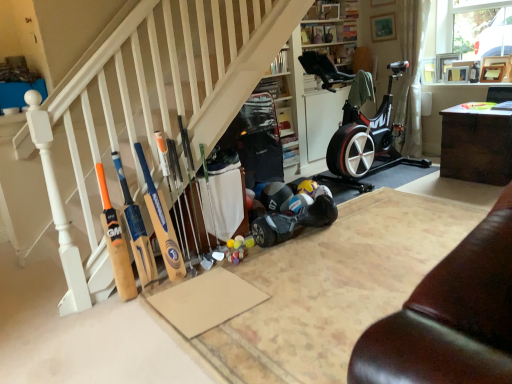
Question: Is dark wood table at right positioned behind wooden bat at left, placed as the first baseball bat when sorted from left to right?

Choices:
 (A) yes
 (B) no

Answer: (A)

Question: Is dark wood table at right in contact with wooden bat at left, the 3th baseball bat viewed from the right?

Choices:
 (A) yes
 (B) no

Answer: (B)

Question: Is dark wood table at right completely or partially outside of wooden bat at left, the 3th baseball bat viewed from the right?

Choices:
 (A) yes
 (B) no

Answer: (A)

Question: Is dark wood table at right not near wooden bat at left, placed as the first baseball bat when sorted from left to right?

Choices:
 (A) yes
 (B) no

Answer: (A)

Question: Is dark wood table at right shorter than wooden bat at left, the 3th baseball bat viewed from the right?

Choices:
 (A) yes
 (B) no

Answer: (A)

Question: Is dark wood table at right thinner than wooden bat at left, placed as the first baseball bat when sorted from left to right?

Choices:
 (A) yes
 (B) no

Answer: (B)

Question: Does dark wood table at right have a greater height compared to wooden baseball bat at center, arranged as the first baseball bat when viewed from the right?

Choices:
 (A) yes
 (B) no

Answer: (B)

Question: Could you tell me if dark wood table at right is facing wooden baseball bat at center, marked as the 3th baseball bat in a left-to-right arrangement?

Choices:
 (A) yes
 (B) no

Answer: (A)

Question: Is wooden baseball bat at center, marked as the 3th baseball bat in a left-to-right arrangement, at the back of dark wood table at right?

Choices:
 (A) no
 (B) yes

Answer: (A)

Question: Is dark wood table at right not within wooden baseball bat at center, marked as the 3th baseball bat in a left-to-right arrangement?

Choices:
 (A) yes
 (B) no

Answer: (A)

Question: From the image's perspective, is dark wood table at right below wooden baseball bat at center, arranged as the first baseball bat when viewed from the right?

Choices:
 (A) no
 (B) yes

Answer: (A)

Question: Is dark wood table at right far away from wooden baseball bat at center, arranged as the first baseball bat when viewed from the right?

Choices:
 (A) no
 (B) yes

Answer: (B)

Question: Are wooden bat at left, the 3th baseball bat viewed from the right, and wooden baseball bat at center, arranged as the first baseball bat when viewed from the right, beside each other?

Choices:
 (A) yes
 (B) no

Answer: (B)